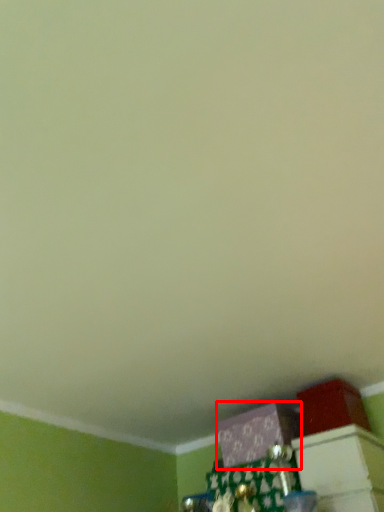
Question: Considering the relative positions of box (annotated by the red box) and box in the image provided, where is box (annotated by the red box) located with respect to the staircase?

Choices:
 (A) right
 (B) left

Answer: (B)